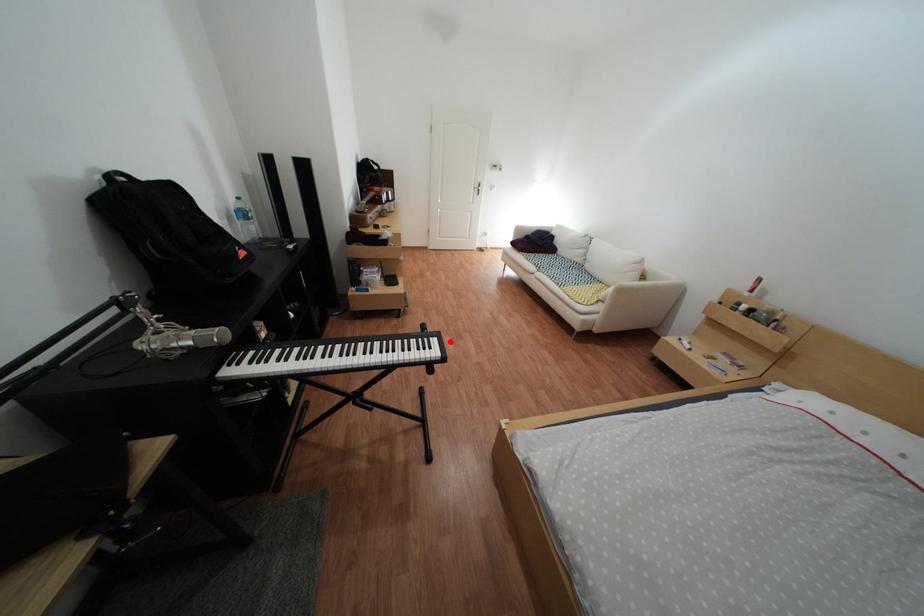
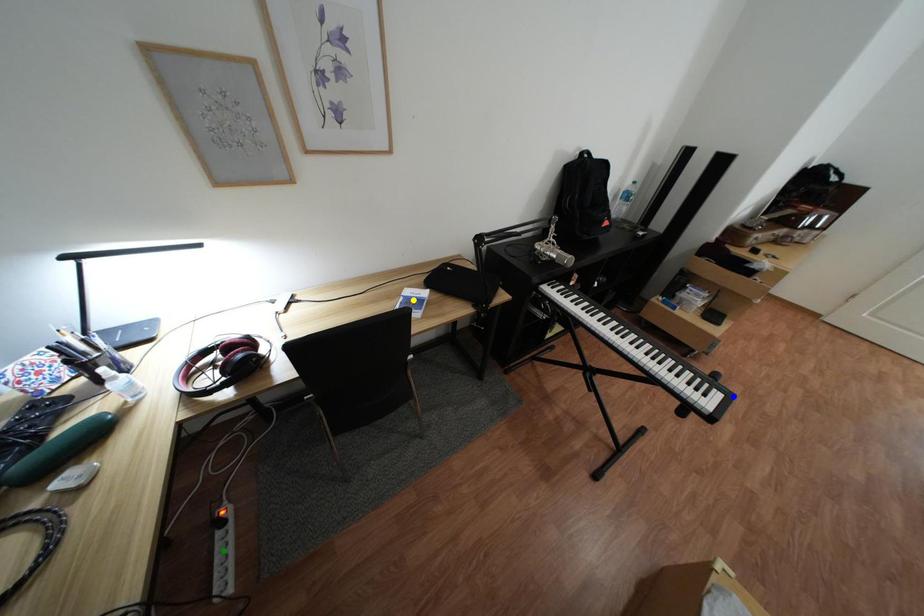
Question: I am providing you with two images of the same scene from different viewpoints. A red point is marked on the first image. You are given multiple points on the second image. Which spot in image 2 lines up with the point in image 1?

Choices:
 (A) green point
 (B) blue point
 (C) yellow point

Answer: (B)